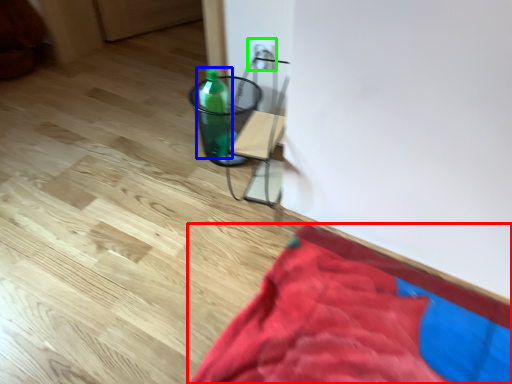
Question: Which is farther away from blanket (highlighted by a red box)? bottle (highlighted by a blue box) or electric outlet (highlighted by a green box)?

Choices:
 (A) bottle
 (B) electric outlet

Answer: (B)